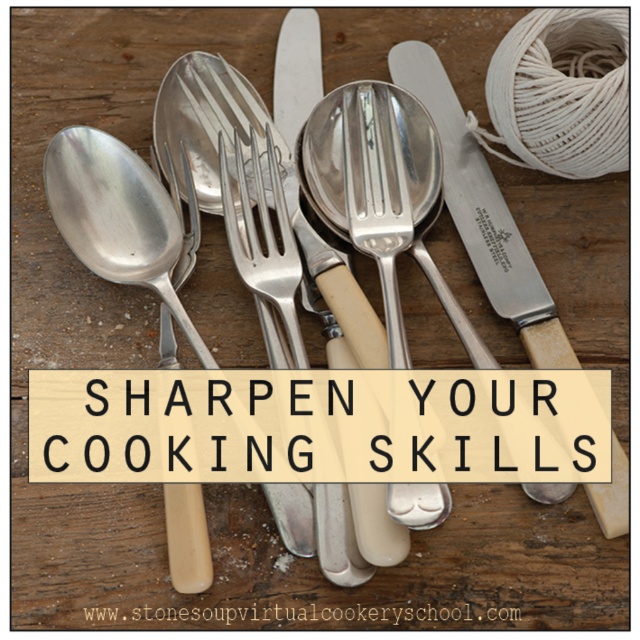
Question: Does brushed metal spoon at left appear on the left side of silver metallic fork at center?

Choices:
 (A) no
 (B) yes

Answer: (B)

Question: Which object is closer to the camera taking this photo?

Choices:
 (A) shiny silver spoon at center
 (B) polished metal fork at center
 (C) brushed metal spoon at left
 (D) silver metallic fork at center

Answer: (C)

Question: Which point is closer to the camera?

Choices:
 (A) (298, 275)
 (B) (196, 589)
 (C) (182, 268)
 (D) (392, 349)

Answer: (B)

Question: In this image, where is brushed metal spoon at left located relative to silver metallic spoon at upper center?

Choices:
 (A) below
 (B) above

Answer: (A)

Question: From the image, what is the correct spatial relationship of brushed metal spoon at left in relation to silver metallic fork at center?

Choices:
 (A) below
 (B) above

Answer: (A)

Question: Among these objects, which one is farthest from the camera?

Choices:
 (A) silver metallic fork at center
 (B) shiny silver spoon at center
 (C) silver metallic spoon at upper center

Answer: (B)